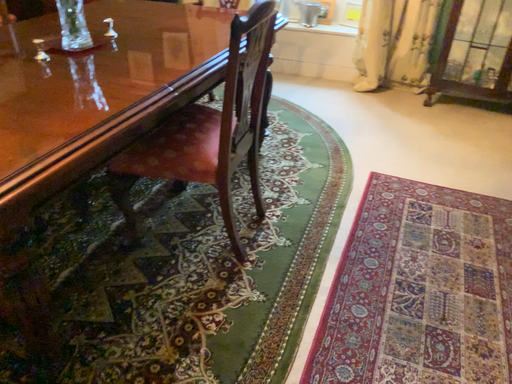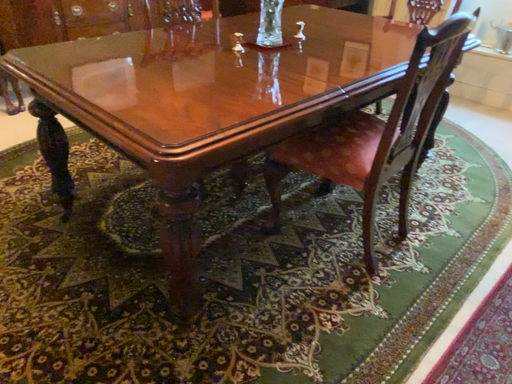
Question: How did the camera likely rotate when shooting the video?

Choices:
 (A) rotated left
 (B) rotated right

Answer: (A)